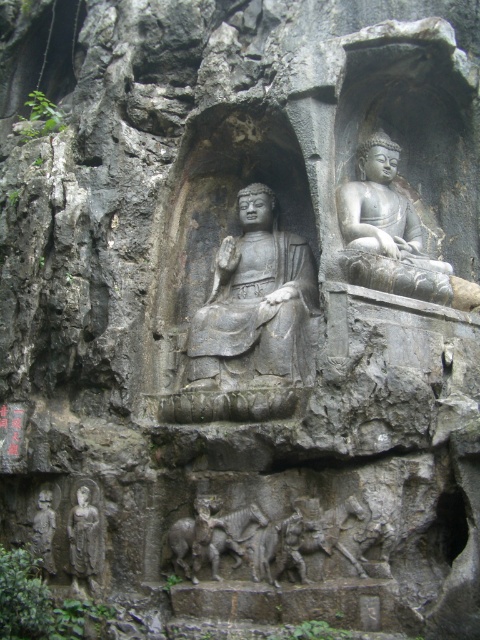
You are a photographer standing at the base of the cliff face. You want to take a photo of both point (249, 278) and point (44, 492) in the same frame. Which point is closer to your camera lens?

Point (44, 492) is closer to the camera lens because it is less further away than point (249, 278).

You are an art conservator examining the carved stone relief sculpture. You need to assess which part is more accessible for immediate inspection without moving your position. Based on the scene, which object is closer to you between the dark gray stone relief at center and the gray stone buddha at upper center?

The dark gray stone relief at center is closer to the viewer than the gray stone buddha at upper center, so it is more accessible for immediate inspection without moving position.

You are a tour guide standing at the base of the cliff. You want to take a photo that includes both the gray stone statue at center and the dark gray stone relief at center. If your camera can focus on objects up to 10 meters away, will you be able to capture both in one shot?

The gray stone statue at center and dark gray stone relief at center are 11.21 meters away from each other. Since your camera can only focus up to 10 meters, you won wait be able to capture both in one shot as the distance between them exceeds the camera range.